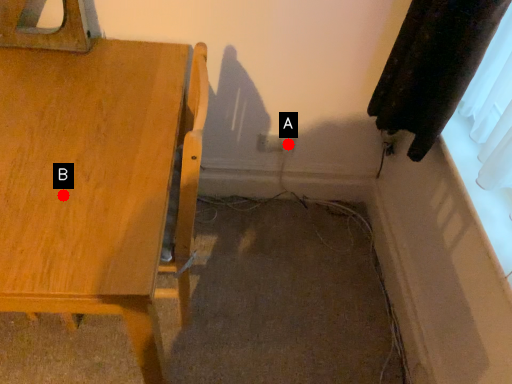
Question: Two points are circled on the image, labeled by A and B beside each circle. Among these points, which one is farthest from the camera?

Choices:
 (A) A is further
 (B) B is further

Answer: (A)